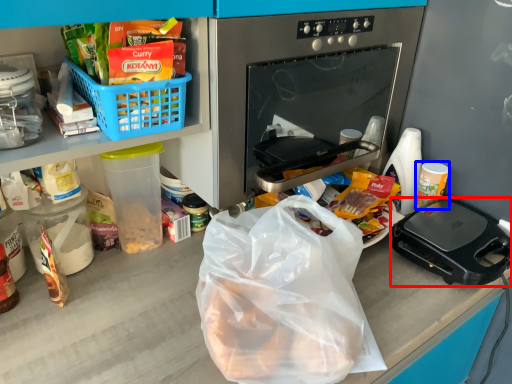
Question: Which object is closer to the camera taking this photo, kitchen appliance (highlighted by a red box) or coffee cup (highlighted by a blue box)?

Choices:
 (A) kitchen appliance
 (B) coffee cup

Answer: (A)